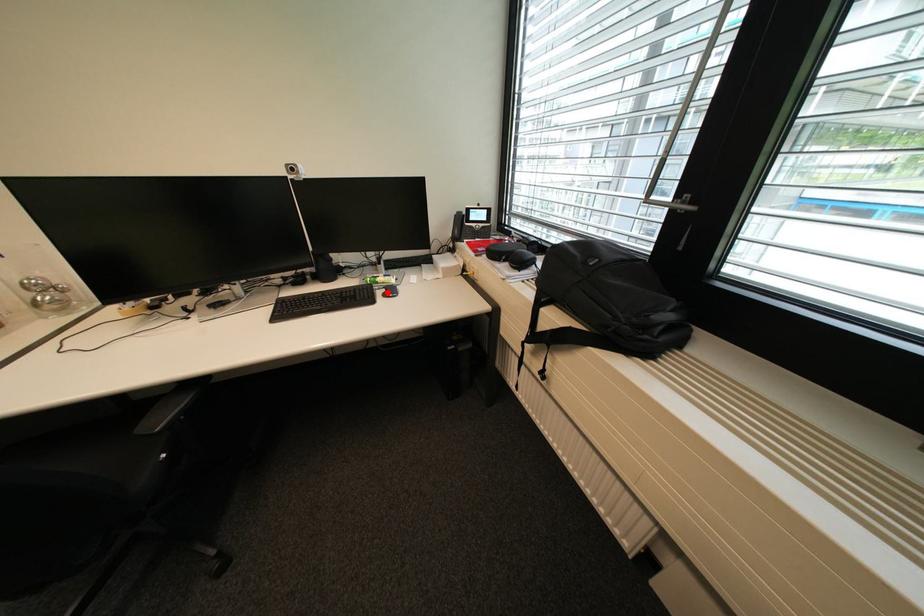
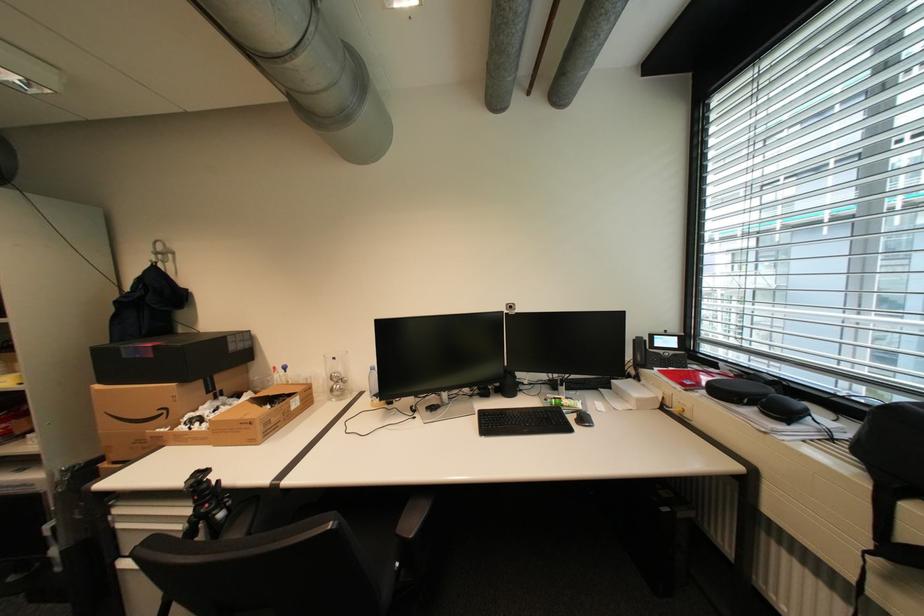
The point at the highlighted location is marked in the first image. Where is the corresponding point in the second image?

(579, 419)